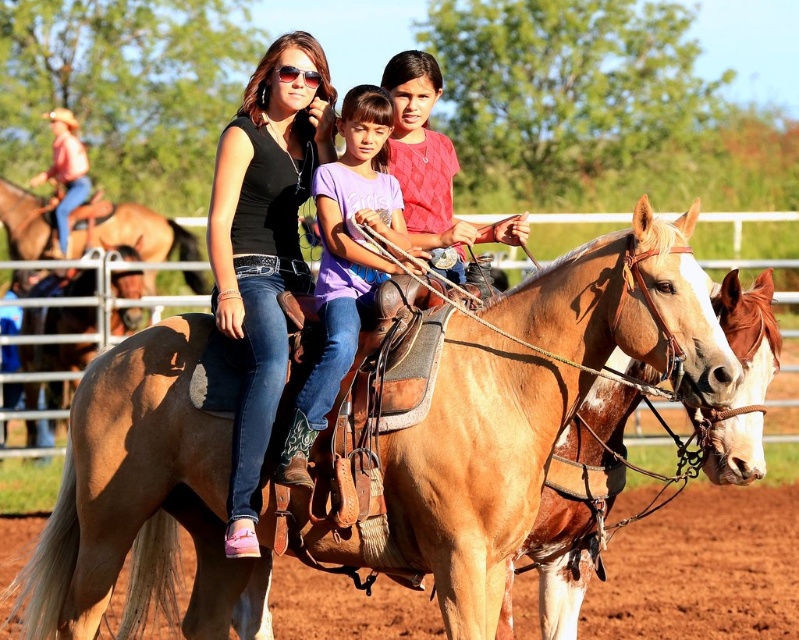
Question: Does purple denim jeans at center have a lesser width compared to brown leather saddle at center?

Choices:
 (A) yes
 (B) no

Answer: (A)

Question: Observing the image, what is the correct spatial positioning of matte black shirt at center in reference to purple denim jeans at center?

Choices:
 (A) below
 (B) above

Answer: (B)

Question: Which object is positioned farthest from the light brown leather saddle at center?

Choices:
 (A) brown leather horse at center
 (B) matte black shirt at center
 (C) brown leather saddle at center
 (D) brown leather saddle at upper left

Answer: (D)

Question: Estimate the real-world distances between objects in this image. Which object is closer to the brown leather saddle at center?

Choices:
 (A) brown leather horse at center
 (B) purple denim jeans at center

Answer: (B)

Question: Which point is closer to the camera?

Choices:
 (A) brown leather horse at center
 (B) light brown leather saddle at center
 (C) purple denim jeans at center

Answer: (A)

Question: Can you confirm if matte black shirt at center is positioned to the right of purple denim jeans at center?

Choices:
 (A) yes
 (B) no

Answer: (B)